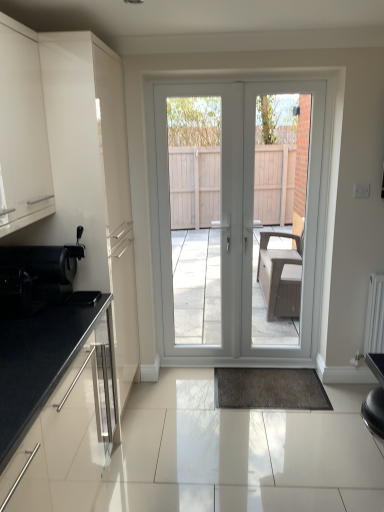
Question: Is shiny black coffee machine at left bigger than white plastic door at center, arranged as the second screen door when viewed from the left?

Choices:
 (A) no
 (B) yes

Answer: (A)

Question: Does shiny black coffee machine at left appear on the right side of white plastic door at center, arranged as the second screen door when viewed from the left?

Choices:
 (A) no
 (B) yes

Answer: (A)

Question: Is shiny black coffee machine at left outside white plastic door at center, the 1th screen door viewed from the right?

Choices:
 (A) yes
 (B) no

Answer: (A)

Question: From the image's perspective, is shiny black coffee machine at left on top of white plastic door at center, the 1th screen door viewed from the right?

Choices:
 (A) yes
 (B) no

Answer: (B)

Question: From the image's perspective, is shiny black coffee machine at left below white plastic door at center, the 1th screen door viewed from the right?

Choices:
 (A) no
 (B) yes

Answer: (B)

Question: Considering the positions of point click(x=160, y=240) and point click(x=256, y=265), is point click(x=160, y=240) closer or farther from the camera than point click(x=256, y=265)?

Choices:
 (A) closer
 (B) farther

Answer: (A)

Question: Is white glossy door at center, which ranks as the 2th screen door in right-to-left order, inside or outside of white plastic door at center, arranged as the second screen door when viewed from the left?

Choices:
 (A) outside
 (B) inside

Answer: (A)

Question: From a real-world perspective, is white glossy door at center, the first screen door viewed from the left, above or below white plastic door at center, arranged as the second screen door when viewed from the left?

Choices:
 (A) above
 (B) below

Answer: (A)

Question: Is white glossy door at center, the first screen door viewed from the left, in front of or behind white plastic door at center, the 1th screen door viewed from the right, in the image?

Choices:
 (A) front
 (B) behind

Answer: (B)

Question: Is matte white cabinet at left, the second cabinetry from the bottom, inside the boundaries of white glossy door at center, or outside?

Choices:
 (A) outside
 (B) inside

Answer: (A)

Question: Considering their positions, is matte white cabinet at left, which is the first cabinetry in top-to-bottom order, located in front of or behind white glossy door at center?

Choices:
 (A) behind
 (B) front

Answer: (B)

Question: In terms of width, does matte white cabinet at left, the second cabinetry from the bottom, look wider or thinner when compared to white glossy door at center?

Choices:
 (A) thin
 (B) wide

Answer: (B)

Question: From a real-world perspective, is matte white cabinet at left, the second cabinetry from the bottom, above or below white glossy door at center?

Choices:
 (A) above
 (B) below

Answer: (A)

Question: Is point (317, 164) closer or farther from the camera than point (72, 347)?

Choices:
 (A) closer
 (B) farther

Answer: (B)

Question: Looking at their shapes, would you say white plastic door at center, the 1th screen door viewed from the right, is wider or thinner than black granite countertop at lower left, positioned as the second cabinetry in top-to-bottom order?

Choices:
 (A) thin
 (B) wide

Answer: (A)